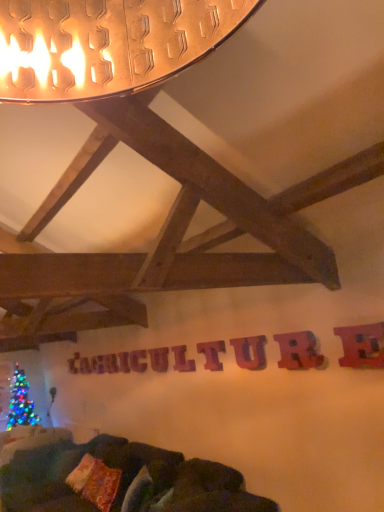
The height and width of the screenshot is (512, 384). Describe the element at coordinates (212, 354) in the screenshot. I see `wooden letter at center, the fourth letter in the front-to-back sequence` at that location.

This screenshot has height=512, width=384. Identify the location of wooden letter at center, positioned as the 4th letter in back-to-front order. (159, 359).

Image resolution: width=384 pixels, height=512 pixels. In order to click on velvety brown pillow at lower center, positioned as the second pillow in right-to-left order in this screenshot , I will do `click(102, 485)`.

How much space does metallic red letter at upper right, which appears as the ninth letter when viewed from the back, occupy vertically?

The height of metallic red letter at upper right, which appears as the ninth letter when viewed from the back, is 27.73 centimeters.

What do you see at coordinates (138, 361) in the screenshot? This screenshot has width=384, height=512. I see `wooden letter at center, which ranks as the seventh letter in right-to-left order` at bounding box center [138, 361].

What is the approximate height of wooden letter at center, which is the fifth letter in back-to-front order?

It is 10.92 inches.

I want to click on wooden letter at center, which ranks as the 1th letter in left-to-right order, so click(x=85, y=365).

Is point (138, 352) positioned after point (136, 463)?

Yes, it is behind point (136, 463).

Considering the relative sizes of wooden letter at center, which ranks as the seventh letter in right-to-left order, and velvet dark green couch at lower center in the image provided, is wooden letter at center, which ranks as the seventh letter in right-to-left order, taller than velvet dark green couch at lower center?

Incorrect, the height of wooden letter at center, which ranks as the seventh letter in right-to-left order, is not larger of that of velvet dark green couch at lower center.

How much distance is there between wooden letter at center, positioned as the seventh letter in front-to-back order, and velvet dark green couch at lower center?

The distance of wooden letter at center, positioned as the seventh letter in front-to-back order, from velvet dark green couch at lower center is 1.35 meters.

Considering the relative positions of wooden letter at center, which ranks as the seventh letter in right-to-left order, and velvet dark green couch at lower center in the image provided, is wooden letter at center, which ranks as the seventh letter in right-to-left order, to the left or to the right of velvet dark green couch at lower center?

From the image, it's evident that wooden letter at center, which ranks as the seventh letter in right-to-left order, is to the right of velvet dark green couch at lower center.

From a real-world perspective, is velvety orange pillow at lower center, positioned as the 2th pillow in back-to-front order, on wooden letter at center, which is counted as the 2th letter, starting from the right?

Actually, velvety orange pillow at lower center, positioned as the 2th pillow in back-to-front order, is physically below wooden letter at center, which is counted as the 2th letter, starting from the right, in the real world.

What's the angular difference between velvety orange pillow at lower center, placed as the first pillow when sorted from right to left, and wooden letter at center, which is the eighth letter in left-to-right order,'s facing directions?

19.5 degrees separate the facing orientations of velvety orange pillow at lower center, placed as the first pillow when sorted from right to left, and wooden letter at center, which is the eighth letter in left-to-right order.

Does velvety orange pillow at lower center, placed as the first pillow when sorted from right to left, have a smaller size compared to wooden letter at center, which is the eighth letter in back-to-front order?

Actually, velvety orange pillow at lower center, placed as the first pillow when sorted from right to left, might be larger than wooden letter at center, which is the eighth letter in back-to-front order.

From the image's perspective, would you say velvety orange pillow at lower center, positioned as the 2th pillow in back-to-front order, is positioned over wooden letter at center, which is the 2th letter in front-to-back order?

No, from the image's perspective, velvety orange pillow at lower center, positioned as the 2th pillow in back-to-front order, is not above wooden letter at center, which is the 2th letter in front-to-back order.

Is metallic red letter at upper right, which appears as the ninth letter when viewed from the back, placed right next to purple wood letter at center, the 7th letter when ordered from back to front?

metallic red letter at upper right, which appears as the ninth letter when viewed from the back, and purple wood letter at center, the 7th letter when ordered from back to front, are clearly separated.

From their relative heights in the image, would you say metallic red letter at upper right, the first letter when ordered from right to left, is taller or shorter than purple wood letter at center, which is counted as the third letter, starting from the front?

In the image, metallic red letter at upper right, the first letter when ordered from right to left, appears to be shorter than purple wood letter at center, which is counted as the third letter, starting from the front.

Does metallic red letter at upper right, arranged as the 1th letter when viewed from the front, have a larger size compared to purple wood letter at center, positioned as the 3th letter in right-to-left order?

Indeed, metallic red letter at upper right, arranged as the 1th letter when viewed from the front, has a larger size compared to purple wood letter at center, positioned as the 3th letter in right-to-left order.

Which object is positioned more to the right, metallic red letter at upper right, the first letter when ordered from right to left, or purple wood letter at center, the 7th letter when ordered from back to front?

metallic red letter at upper right, the first letter when ordered from right to left, is more to the right.

Between velvet dark green couch at lower center and wooden letter at center, which is the second letter in back-to-front order, which one has less height?

wooden letter at center, which is the second letter in back-to-front order, is shorter.

Which is more to the right, velvet dark green couch at lower center or wooden letter at center, the second letter positioned from the left?

wooden letter at center, the second letter positioned from the left.

Is point (159, 511) closer to camera compared to point (122, 355)?

Yes, point (159, 511) is in front of point (122, 355).

Considering the sizes of objects velvet dark green couch at lower center and wooden letter at center, the second letter positioned from the left, in the image provided, who is wider, velvet dark green couch at lower center or wooden letter at center, the second letter positioned from the left,?

velvet dark green couch at lower center.

Locate an element on the screen. letter that is the 2nd object above the velvety orange pillow at lower center, the 1th pillow in the front-to-back sequence (from a real-world perspective) is located at coordinates (138, 361).

Considering the relative sizes of velvety orange pillow at lower center, positioned as the 2th pillow in back-to-front order, and wooden letter at center, which is the third letter from back to front, in the image provided, is velvety orange pillow at lower center, positioned as the 2th pillow in back-to-front order, smaller than wooden letter at center, which is the third letter from back to front,?

No, velvety orange pillow at lower center, positioned as the 2th pillow in back-to-front order, is not smaller than wooden letter at center, which is the third letter from back to front.

Does point (140, 498) appear closer or farther from the camera than point (133, 359)?

Point (140, 498) appears to be closer to the viewer than point (133, 359).

Looking at their sizes, would you say velvety orange pillow at lower center, the 1th pillow in the front-to-back sequence, is wider or thinner than wooden letter at center, which is the third letter in left-to-right order?

In the image, velvety orange pillow at lower center, the 1th pillow in the front-to-back sequence, appears to be wider than wooden letter at center, which is the third letter in left-to-right order.

Considering the positions of objects purple wood letter at center, positioned as the 3th letter in right-to-left order, and velvet dark green couch at lower center in the image provided, who is behind, purple wood letter at center, positioned as the 3th letter in right-to-left order, or velvet dark green couch at lower center?

Positioned behind is purple wood letter at center, positioned as the 3th letter in right-to-left order.

Locate an element on the screen. Image resolution: width=384 pixels, height=512 pixels. studio couch below the purple wood letter at center, placed as the 7th letter when sorted from left to right (from the image's perspective) is located at coordinates tap(113, 477).

Would you say purple wood letter at center, placed as the 7th letter when sorted from left to right, is outside velvet dark green couch at lower center?

Yes, purple wood letter at center, placed as the 7th letter when sorted from left to right, is outside of velvet dark green couch at lower center.

From a real-world perspective, who is located lower, purple wood letter at center, the 7th letter when ordered from back to front, or velvet dark green couch at lower center?

In real-world perspective, velvet dark green couch at lower center is lower.

Between purple wood letter at center, which is counted as the third letter, starting from the front, and velvety brown pillow at lower center, positioned as the 1th pillow in back-to-front order, which one has smaller size?

purple wood letter at center, which is counted as the third letter, starting from the front.

Which is behind, point (254, 367) or point (106, 469)?

The point (106, 469) is behind.

From their relative heights in the image, would you say purple wood letter at center, positioned as the 3th letter in right-to-left order, is taller or shorter than velvety brown pillow at lower center, positioned as the second pillow in right-to-left order?

purple wood letter at center, positioned as the 3th letter in right-to-left order, is shorter than velvety brown pillow at lower center, positioned as the second pillow in right-to-left order.

Which object is positioned more to the right, purple wood letter at center, positioned as the 3th letter in right-to-left order, or velvety brown pillow at lower center, the first pillow positioned from the left?

Positioned to the right is purple wood letter at center, positioned as the 3th letter in right-to-left order.

The image size is (384, 512). I want to click on studio couch lying in front of the wooden letter at center, positioned as the seventh letter in front-to-back order, so click(x=113, y=477).

From the image's perspective, count 8th letters upward from the velvety orange pillow at lower center, placed as the first pillow when sorted from right to left, and point to it. Please provide its 2D coordinates.

[(298, 351)]

Which object lies further to the anchor point purple wood letter at center, the 7th letter when ordered from back to front, wooden letter at center, which ranks as the 1th letter in left-to-right order, or wooden letter at center, which is the second letter in back-to-front order?

Based on the image, wooden letter at center, which ranks as the 1th letter in left-to-right order, appears to be further to purple wood letter at center, the 7th letter when ordered from back to front.

Looking at the image, which one is located closer to velvety brown pillow at lower center, the first pillow positioned from the left, wooden letter at center, which is the fifth letter in back-to-front order, or wooden letter at center, positioned as the sixth letter in front-to-back order?

Among the two, wooden letter at center, positioned as the sixth letter in front-to-back order, is located nearer to velvety brown pillow at lower center, the first pillow positioned from the left.

Estimate the real-world distances between objects in this image. Which object is further from purple wood letter at center, the 7th letter when ordered from back to front, wooden letter at center, which is the 2th letter in front-to-back order, or metallic red letter at upper right, which appears as the ninth letter when viewed from the back?

Among the two, metallic red letter at upper right, which appears as the ninth letter when viewed from the back, is located further to purple wood letter at center, the 7th letter when ordered from back to front.

Looking at the image, which one is located closer to velvety orange pillow at lower center, placed as the first pillow when sorted from right to left, purple wood letter at center, which is counted as the third letter, starting from the front, or metallic red letter at upper right, the first letter when ordered from right to left?

purple wood letter at center, which is counted as the third letter, starting from the front, lies closer to velvety orange pillow at lower center, placed as the first pillow when sorted from right to left, than the other object.

Estimate the real-world distances between objects in this image. Which object is further from wooden letter at center, the first letter in the back-to-front sequence, wooden letter at center, which ranks as the eighth letter in right-to-left order, or wooden letter at center, which is the eighth letter in back-to-front order?

wooden letter at center, which is the eighth letter in back-to-front order.

Considering their positions, is velvet dark green couch at lower center positioned further to wooden letter at center, which is the fifth letter in back-to-front order, than wooden letter at center, which is the third letter in left-to-right order?

velvet dark green couch at lower center.

From the image, which object appears to be nearer to velvet dark green couch at lower center, wooden letter at center, the first letter in the back-to-front sequence, or wooden letter at center, which is the third letter from back to front?

wooden letter at center, which is the third letter from back to front, is closer to velvet dark green couch at lower center.

Which object lies further to the anchor point wooden letter at center, which ranks as the seventh letter in right-to-left order, wooden letter at center, the 8th letter from the front, or wooden letter at center, which is the sixth letter in right-to-left order?

wooden letter at center, which is the sixth letter in right-to-left order, lies further to wooden letter at center, which ranks as the seventh letter in right-to-left order, than the other object.

Locate an element on the screen. The height and width of the screenshot is (512, 384). letter between metallic red letter at upper right, acting as the ninth letter starting from the left, and purple wood letter at center, the 7th letter when ordered from back to front, along the z-axis is located at coordinates (298, 351).

What are the coordinates of `pillow between wooden letter at center, which is the 4th letter in right-to-left order, and wooden letter at center, which is the ninth letter from right to left, in the front-back direction` in the screenshot? It's located at (102, 485).

This screenshot has width=384, height=512. In order to click on pillow between velvety brown pillow at lower center, positioned as the second pillow in right-to-left order, and metallic red letter at upper right, which appears as the ninth letter when viewed from the back, from left to right in this screenshot , I will do `click(138, 490)`.

Where is `pillow between velvety orange pillow at lower center, the 1th pillow in the front-to-back sequence, and wooden letter at center, which is the ninth letter from right to left, from front to back`? pillow between velvety orange pillow at lower center, the 1th pillow in the front-to-back sequence, and wooden letter at center, which is the ninth letter from right to left, from front to back is located at coordinates (102, 485).